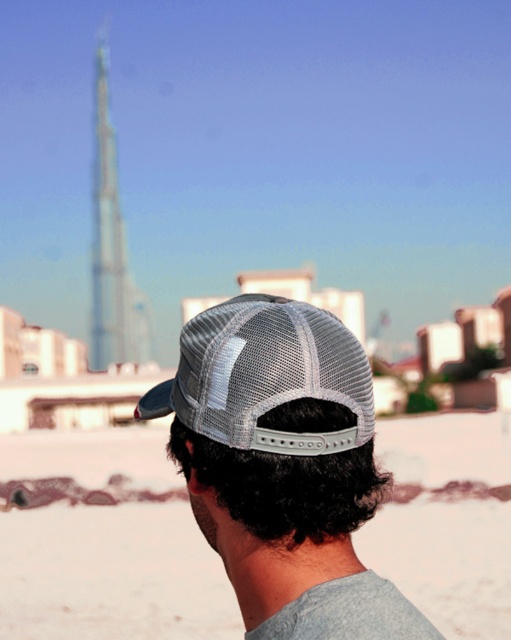
Does white sand at lower center have a greater height compared to transparent glass tower at upper center?

Incorrect, white sand at lower center's height is not larger of transparent glass tower at upper center's.

Is point (96, 476) closer to viewer compared to point (110, 148)?

Yes, point (96, 476) is in front of point (110, 148).

The width and height of the screenshot is (511, 640). I want to click on white sand at lower center, so click(x=111, y=573).

Is gray mesh cap at center smaller than transparent glass tower at upper center?

Correct, gray mesh cap at center occupies less space than transparent glass tower at upper center.

In the scene shown: Who is taller, gray mesh cap at center or transparent glass tower at upper center?

With more height is transparent glass tower at upper center.

Where is `gray mesh cap at center`? This screenshot has width=511, height=640. gray mesh cap at center is located at coordinates (283, 467).

This screenshot has height=640, width=511. What are the coordinates of `gray mesh baseball cap at center` in the screenshot? It's located at (265, 376).

Based on the photo, who is more distant from viewer, [275,340] or [105,234]?

Positioned behind is point [105,234].

Find the location of a particular element. The height and width of the screenshot is (640, 511). gray mesh baseball cap at center is located at coordinates tap(265, 376).